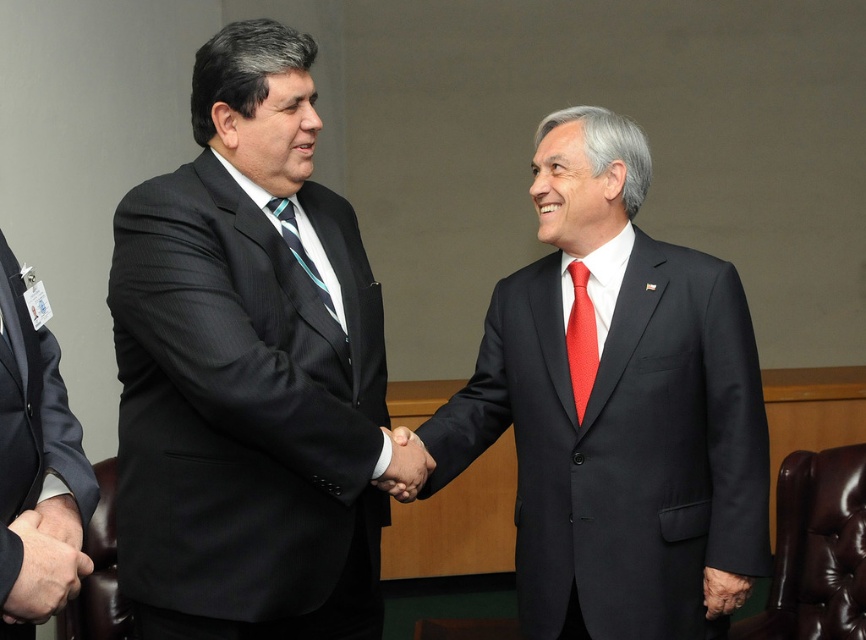
Question: Which of the following is the farthest from the observer?

Choices:
 (A) matte blue tie at center
 (B) matte black suit at center

Answer: (A)

Question: Is matte black suit at center further to the viewer compared to smooth black hand at center?

Choices:
 (A) yes
 (B) no

Answer: (A)

Question: Which of the following is the closest to the observer?

Choices:
 (A) (687, 608)
 (B) (574, 330)
 (C) (314, 276)

Answer: (C)

Question: Can you confirm if matte black suit at center is thinner than dark blue suit at left?

Choices:
 (A) no
 (B) yes

Answer: (A)

Question: Which object is positioned closest to the dark blue suit at left?

Choices:
 (A) matte black suit at right
 (B) matte black suit at center
 (C) smooth black hand at center

Answer: (C)

Question: Is the position of matte black suit at center less distant than that of matte blue tie at center?

Choices:
 (A) yes
 (B) no

Answer: (A)